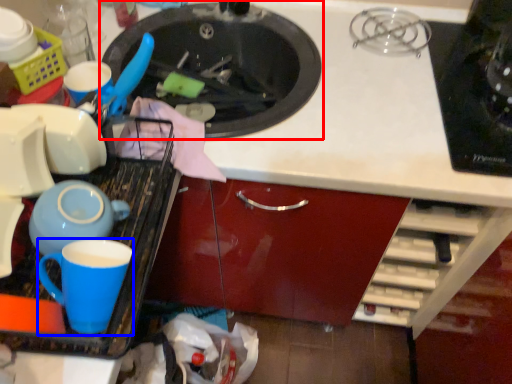
Question: Which object appears farthest to the camera in this image, sink (highlighted by a red box) or coffee cup (highlighted by a blue box)?

Choices:
 (A) sink
 (B) coffee cup

Answer: (A)